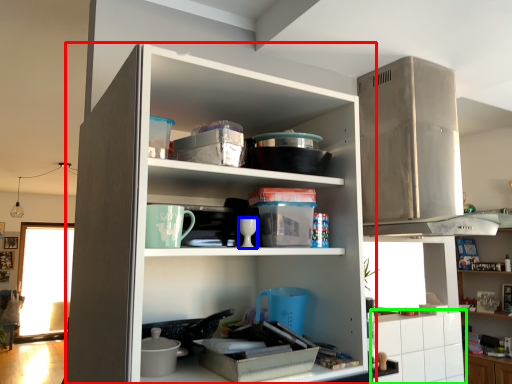
Question: Which is nearer to the cupboard (highlighted by a red box)? tableware (highlighted by a blue box) or cabinetry (highlighted by a green box).

Choices:
 (A) tableware
 (B) cabinetry

Answer: (A)